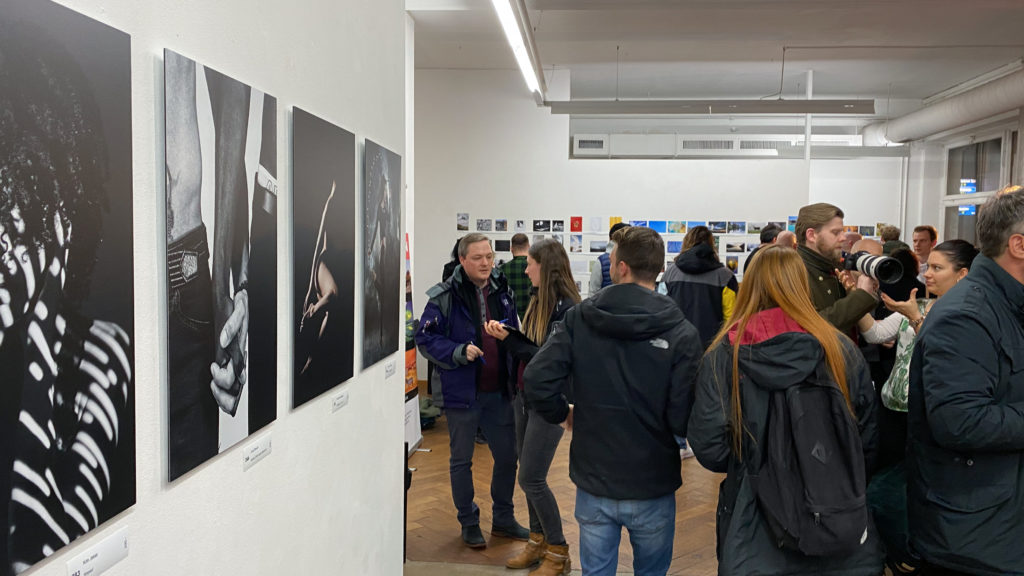
At what (x,y) coordinates should I click in order to perform the action: click on vent overhead. Please return your answer as a coordinate pair (x, y). This screenshot has width=1024, height=576. Looking at the image, I should click on (635, 142), (748, 142), (822, 140).